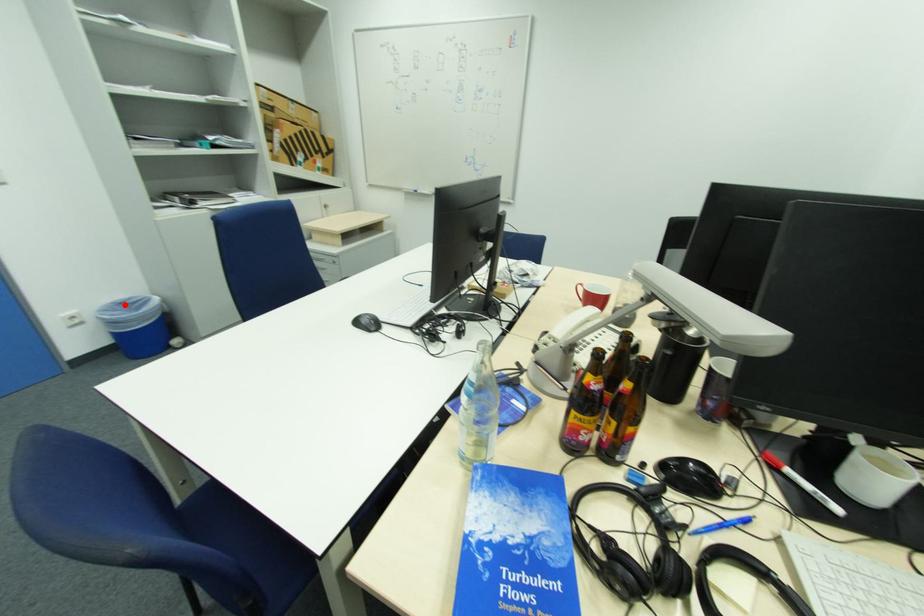
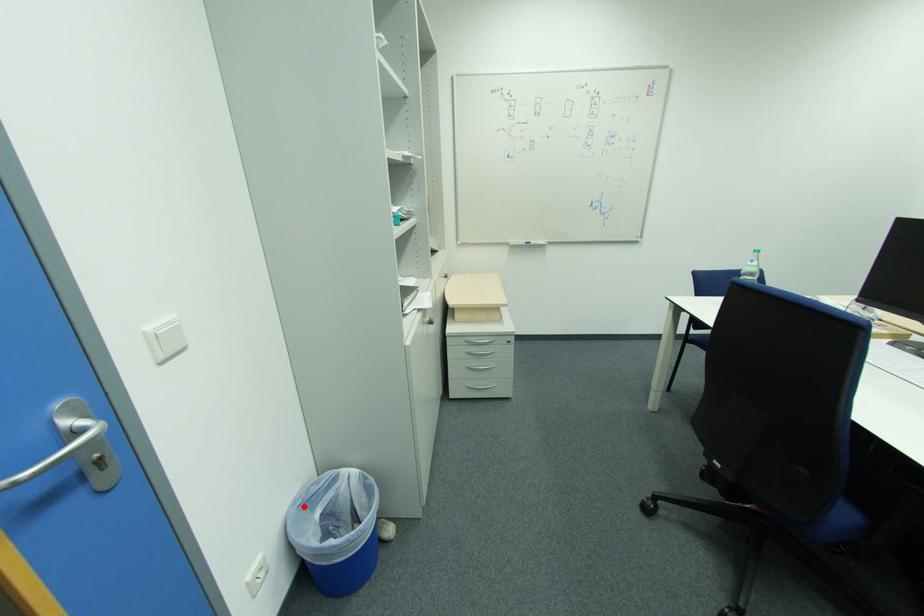
I am providing you with two images of the same scene from different viewpoints. A red point is marked on the first image and another point is marked on the second image. Is the red point in image1 aligned with the point shown in image2?

Yes